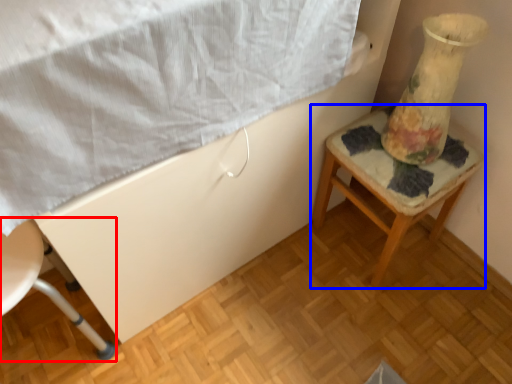
Question: Which of the following is the farthest to the observer, chair (highlighted by a red box) or furniture (highlighted by a blue box)?

Choices:
 (A) chair
 (B) furniture

Answer: (B)